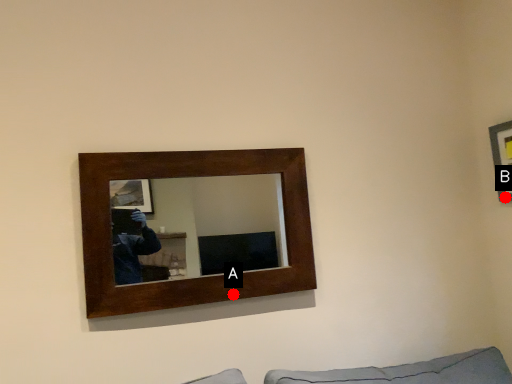
Question: Two points are circled on the image, labeled by A and B beside each circle. Which of the following is the farthest from the observer?

Choices:
 (A) A is further
 (B) B is further

Answer: (B)